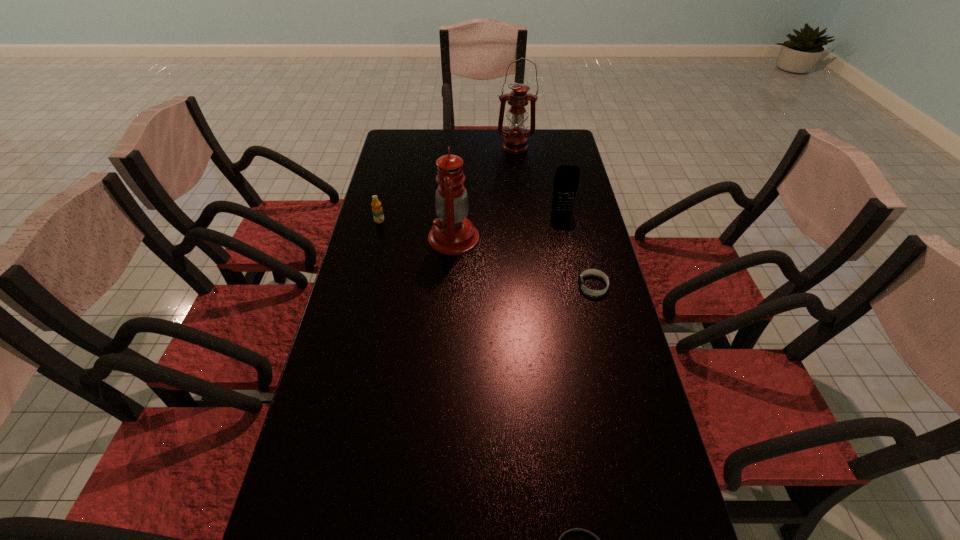
At what (x,y) coordinates should I click in order to perform the action: click on vacant point located between the third shortest object and the fifth object from right to left. Please return your answer as a coordinate pair (x, y). The image size is (960, 540). Looking at the image, I should click on (417, 230).

Identify the location of vacant point located between the third shortest object and the fifth farthest object. The width and height of the screenshot is (960, 540). (487, 253).

Locate an element on the screen. The image size is (960, 540). vacant space that is in between the fifth object from right to left and the right wristband is located at coordinates (523, 262).

Image resolution: width=960 pixels, height=540 pixels. I want to click on free area in between the right oil lamp and the second nearest object, so click(x=554, y=217).

You are a GUI agent. You are given a task and a screenshot of the screen. Output one action in this format:
    pyautogui.click(x=<x>, y=<y>)
    Task: Click on the object that can be found as the third closest to the cellular telephone
    
    Given the screenshot: What is the action you would take?
    pyautogui.click(x=515, y=140)

Where is `object that stands as the fifth closest to the second nearest object`? object that stands as the fifth closest to the second nearest object is located at coordinates (515, 140).